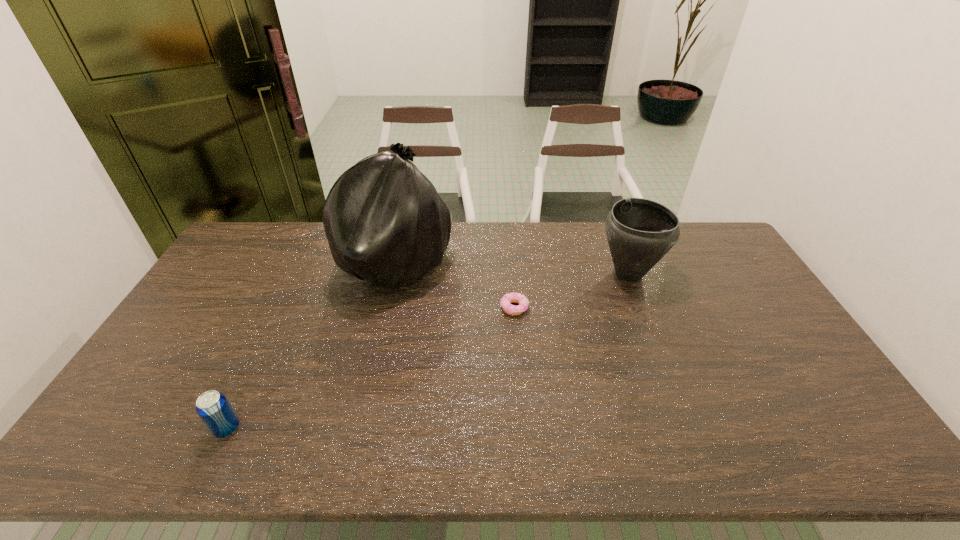
Find the location of `object that can be found as the second closest to the second tallest object`. object that can be found as the second closest to the second tallest object is located at coordinates (385, 223).

I want to click on free location that satisfies the following two spatial constraints: 1. on the back side of the tallest object; 2. on the left side of the leftmost object, so pyautogui.click(x=303, y=266).

In order to click on free region that satisfies the following two spatial constraints: 1. on the front side of the second object from left to right; 2. on the right side of the second tallest object in this screenshot , I will do `click(394, 274)`.